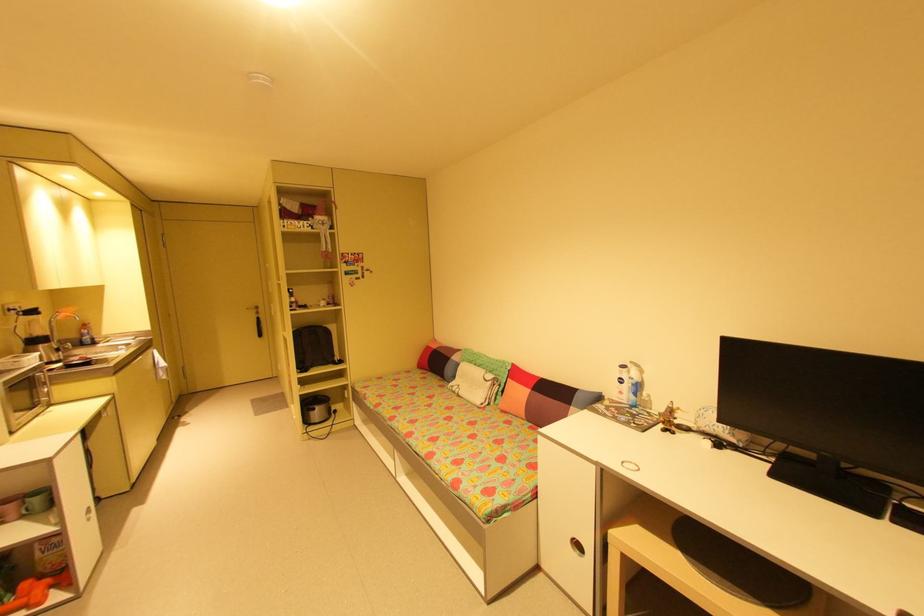
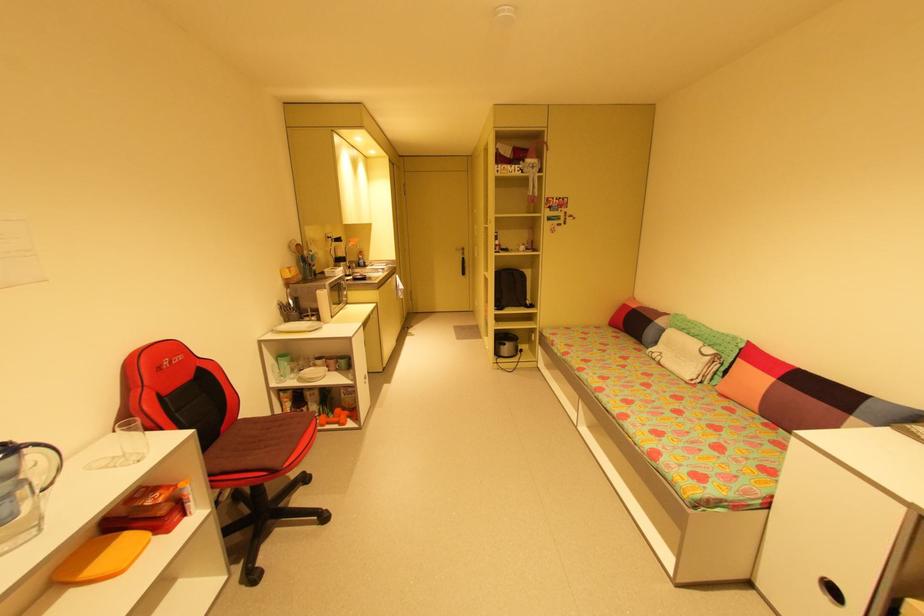
The point at (336, 328) is marked in the first image. Where is the corresponding point in the second image?

(532, 273)